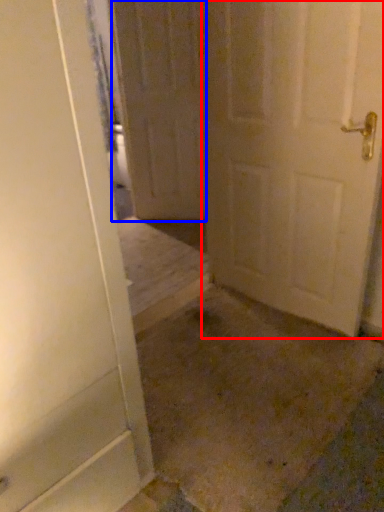
Question: Among these objects, which one is nearest to the camera, door (highlighted by a red box) or door (highlighted by a blue box)?

Choices:
 (A) door
 (B) door

Answer: (A)